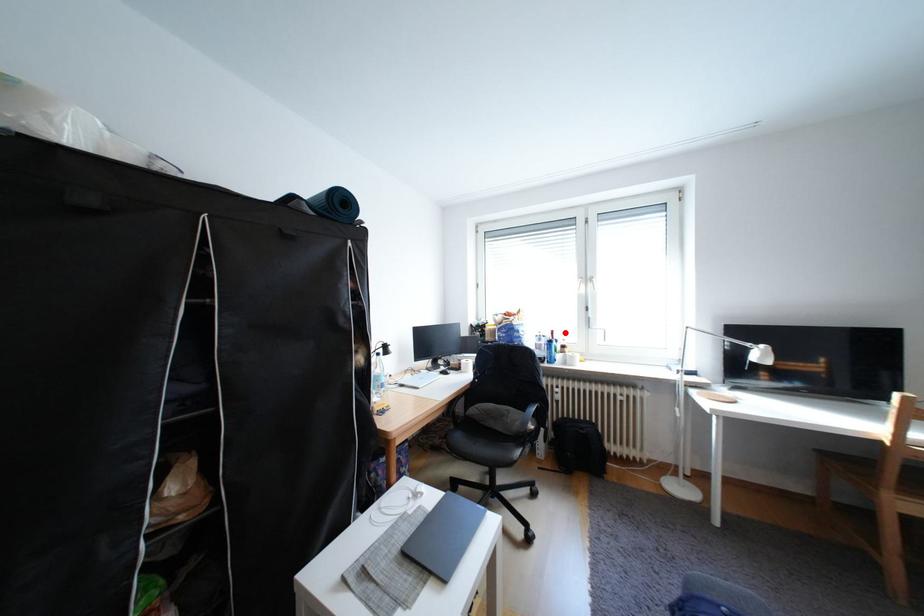
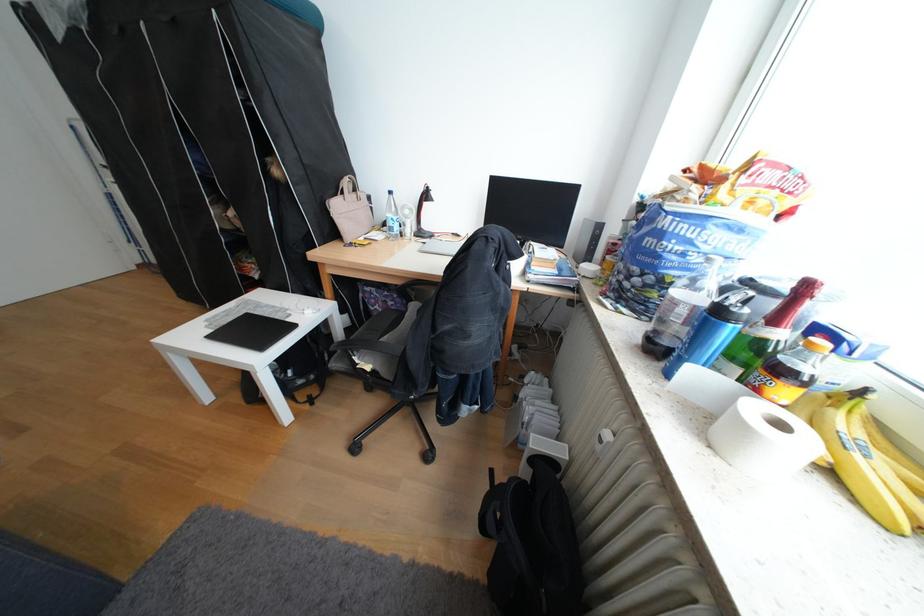
Locate, in the second image, the point that corresponds to the highlighted location in the first image.

(819, 288)